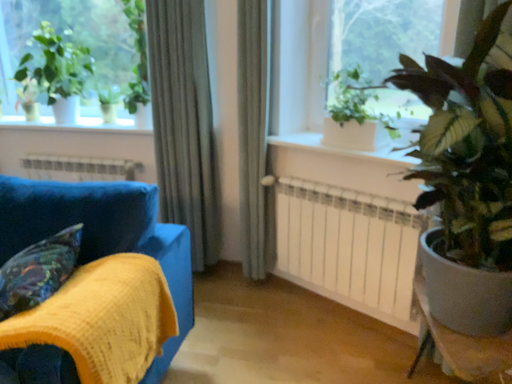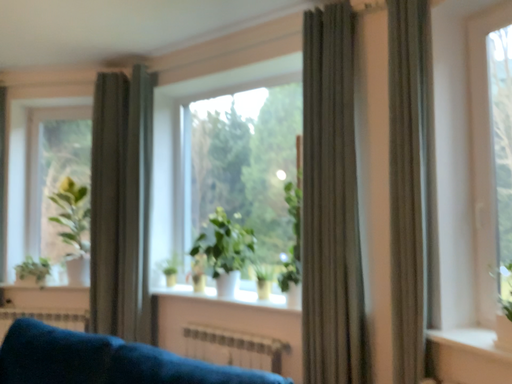
Question: Which way did the camera rotate in the video?

Choices:
 (A) rotated downward
 (B) rotated upward

Answer: (B)